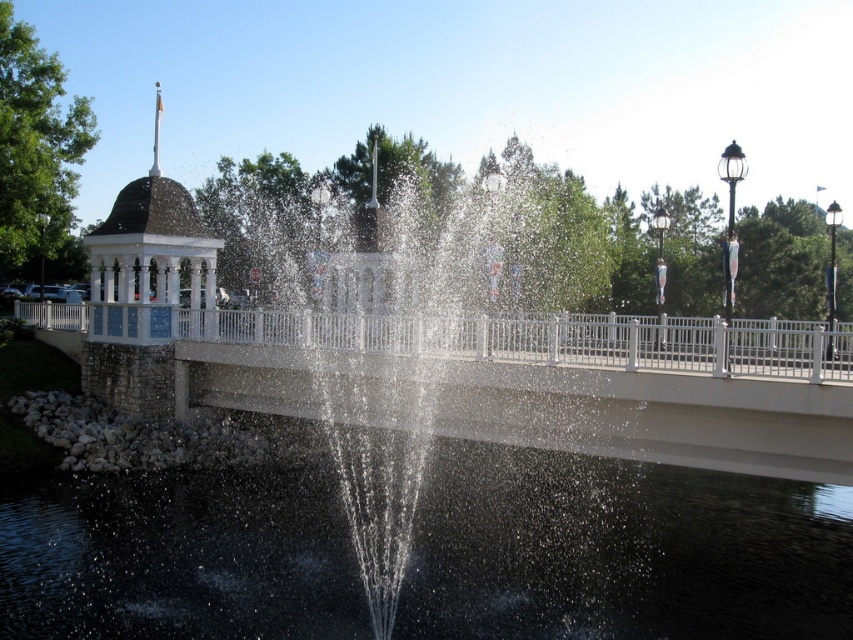
Question: Which object is farther from the camera taking this photo?

Choices:
 (A) white concrete bridge at center
 (B) clear liquid water at center
 (C) clear water at center
 (D) white glossy gazebo at upper left

Answer: (D)

Question: Is white concrete bridge at center above clear water at center?

Choices:
 (A) yes
 (B) no

Answer: (B)

Question: Which point is farther from the camera taking this photo?

Choices:
 (A) (650, 604)
 (B) (120, 237)
 (C) (782, 376)

Answer: (B)

Question: Which object is positioned closest to the clear liquid water at center?

Choices:
 (A) white concrete bridge at center
 (B) white glossy gazebo at upper left

Answer: (A)

Question: Does white concrete bridge at center come behind clear water at center?

Choices:
 (A) yes
 (B) no

Answer: (A)

Question: Is clear liquid water at center behind white glossy gazebo at upper left?

Choices:
 (A) no
 (B) yes

Answer: (A)